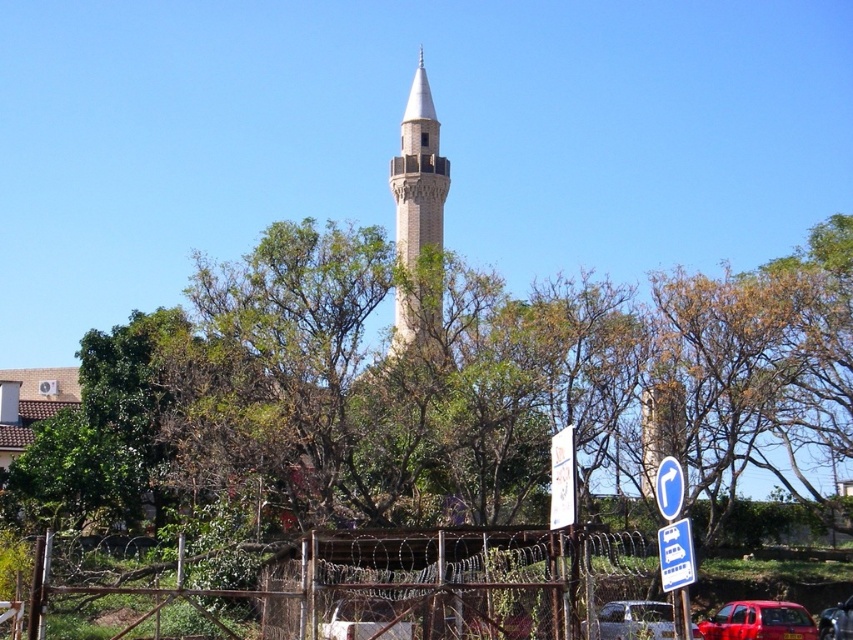
Question: In this image, where is green leafy tree at center located relative to yellow plastic sign at lower right?

Choices:
 (A) right
 (B) left

Answer: (B)

Question: Observing the image, what is the correct spatial positioning of light beige stone minaret at center in reference to metallic red car at center?

Choices:
 (A) above
 (B) below

Answer: (A)

Question: Which of the following is the farthest from the observer?

Choices:
 (A) white plastic sign at center
 (B) shiny red car at lower right
 (C) light beige stone minaret at center
 (D) green leafy tree at center

Answer: (C)

Question: Does white plastic sign at center have a smaller size compared to metallic red car at center?

Choices:
 (A) yes
 (B) no

Answer: (B)

Question: Estimate the real-world distances between objects in this image. Which object is farther from the white plastic sign at center?

Choices:
 (A) light beige stone minaret at center
 (B) yellow plastic sign at lower right
 (C) green leafy tree at center

Answer: (A)

Question: Which point is closer to the camera?

Choices:
 (A) light beige stone minaret at center
 (B) metallic red car at center

Answer: (B)